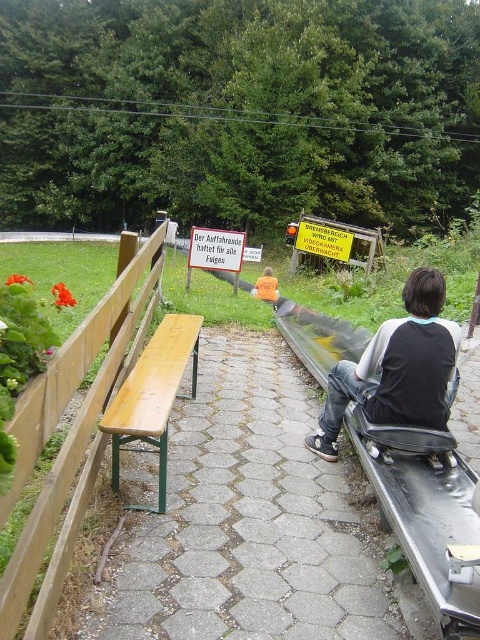
Question: Which object is closer to the camera taking this photo?

Choices:
 (A) light brown wood bench at left
 (B) yellow plastic sign at center
 (C) orange fabric shirt at center
 (D) wooden bench at center

Answer: (D)

Question: Does light brown wood bench at left appear over orange fabric shirt at center?

Choices:
 (A) yes
 (B) no

Answer: (B)

Question: Does wooden bench at center have a lesser width compared to white paper sign at center?

Choices:
 (A) yes
 (B) no

Answer: (B)

Question: Which of the following is the farthest from the observer?

Choices:
 (A) (191, 244)
 (B) (423, 278)
 (C) (343, 230)

Answer: (C)

Question: Is yellow plastic sign at center closer to camera compared to orange fabric shirt at center?

Choices:
 (A) no
 (B) yes

Answer: (A)

Question: Considering the real-world distances, which object is farthest from the orange fabric shirt at center?

Choices:
 (A) black leather jacket at center
 (B) light brown wood bench at left

Answer: (A)